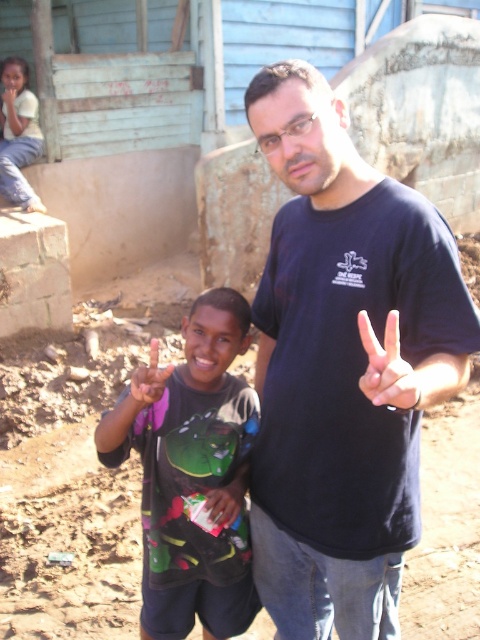
You are standing in the scene and want to place a small flag at the point closer to you between the two points labeled as point (360,515) and point (388,316). Which point should you choose?

You should choose point (360,515) because it is closer to you than point (388,316).